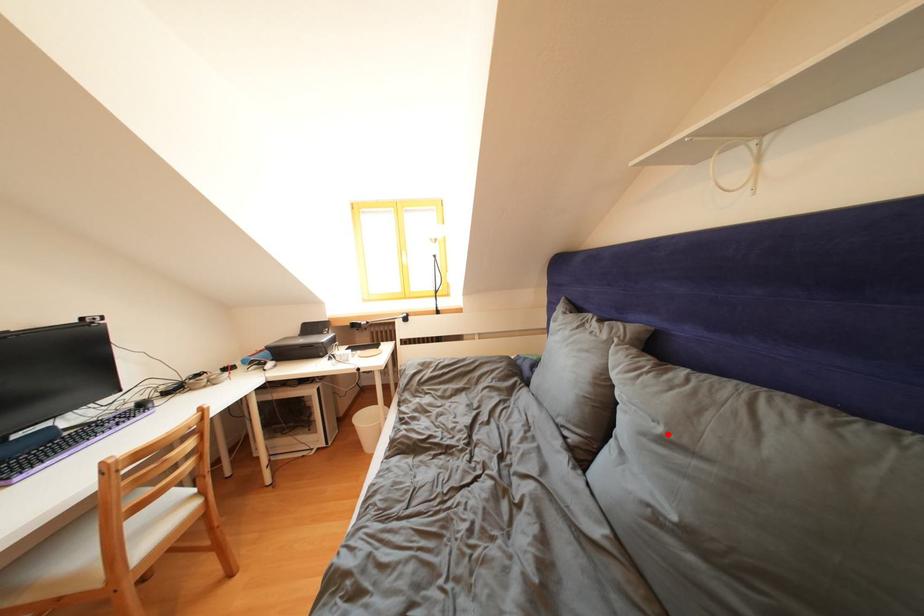
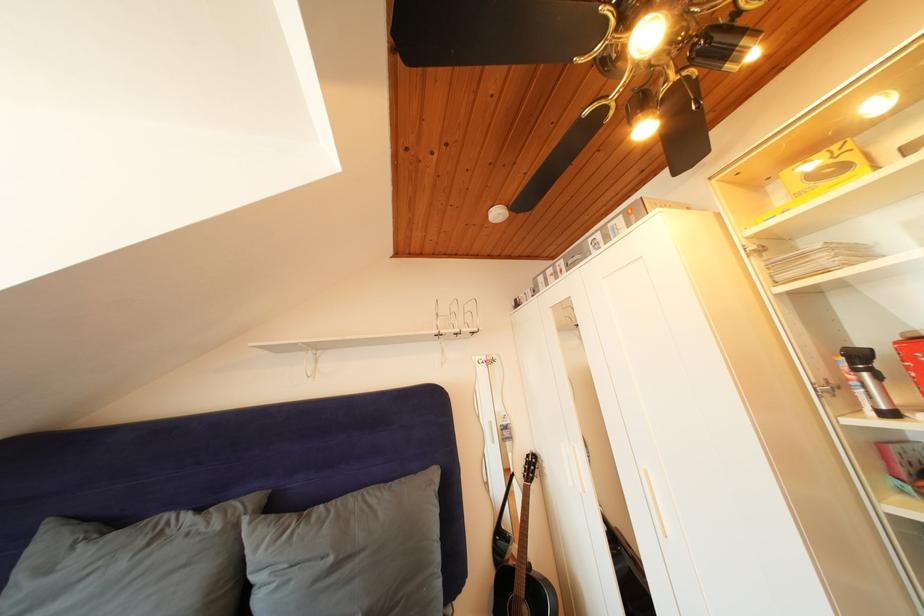
In the second image, find the point that corresponds to the highlighted location in the first image.

(338, 565)